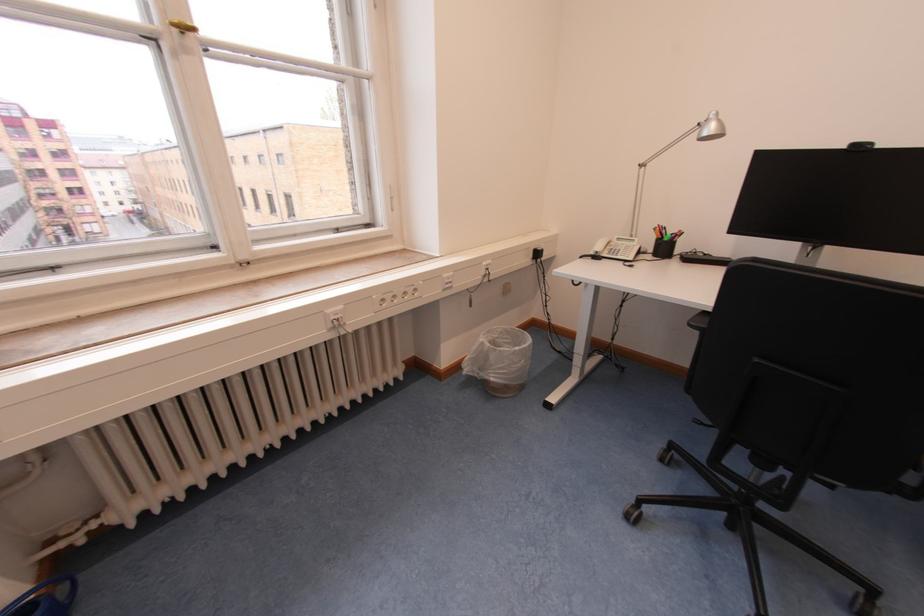
Where is `gold window handle`? Image resolution: width=924 pixels, height=616 pixels. gold window handle is located at coordinates (181, 25).